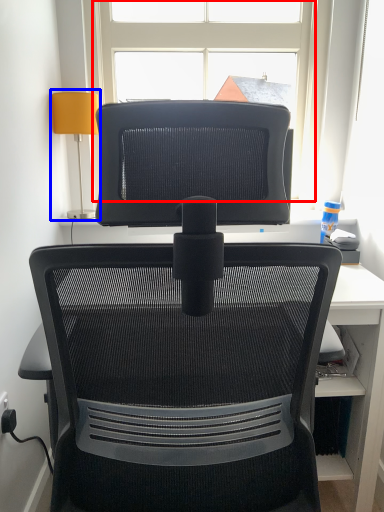
Question: Among these objects, which one is nearest to the camera, window (highlighted by a red box) or table lamp (highlighted by a blue box)?

Choices:
 (A) window
 (B) table lamp

Answer: (B)